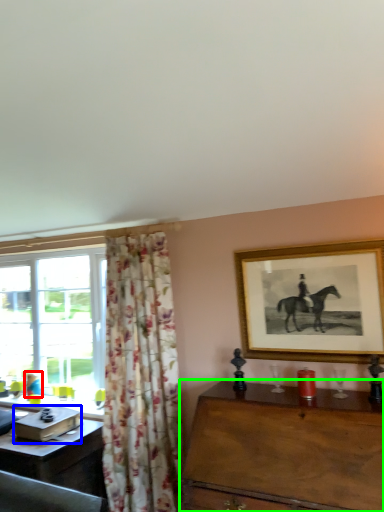
Question: Based on their relative distances, which object is farther from person (highlighted by a red box)? Choose from box (highlighted by a blue box) and table (highlighted by a green box).

Choices:
 (A) box
 (B) table

Answer: (B)